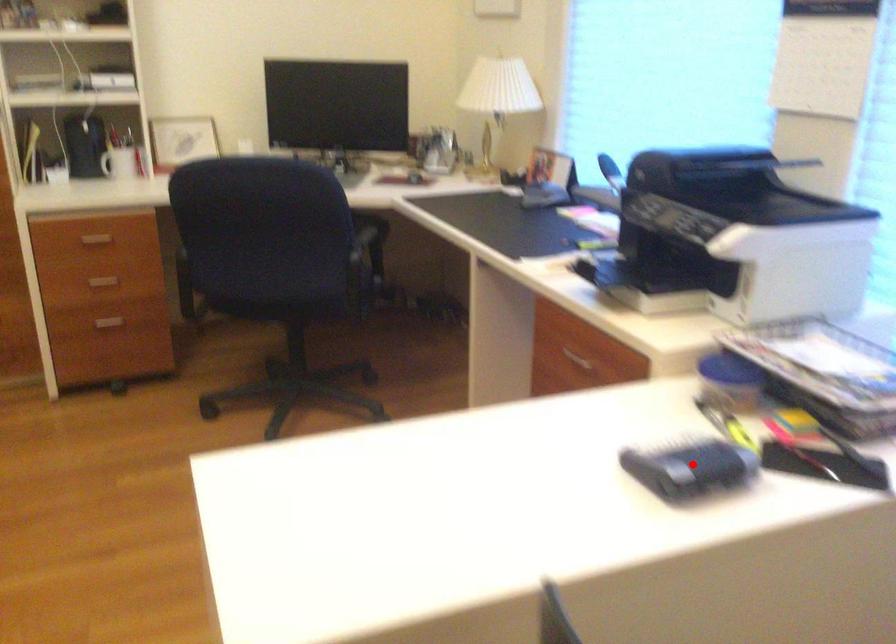
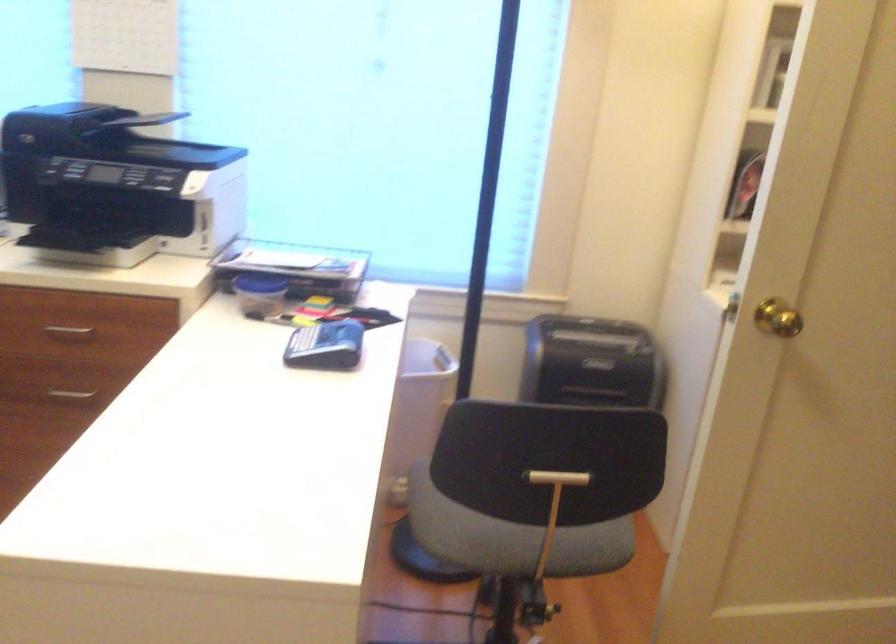
Question: I am providing you with two images of the same scene from different viewpoints. Image1 has a red point marked. In image2, the corresponding 3D location appears at what relative position? Reply with the corresponding letter.

Choices:
 (A) Closer
 (B) Farther

Answer: (B)